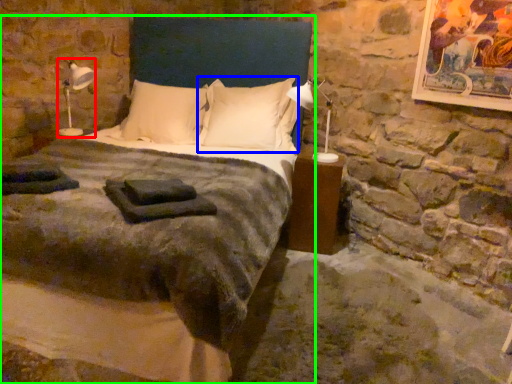
Question: Which object is the closest to the bedside lamp (highlighted by a red box)? Choose among these: pillow (highlighted by a blue box) or bed (highlighted by a green box).

Choices:
 (A) pillow
 (B) bed

Answer: (A)